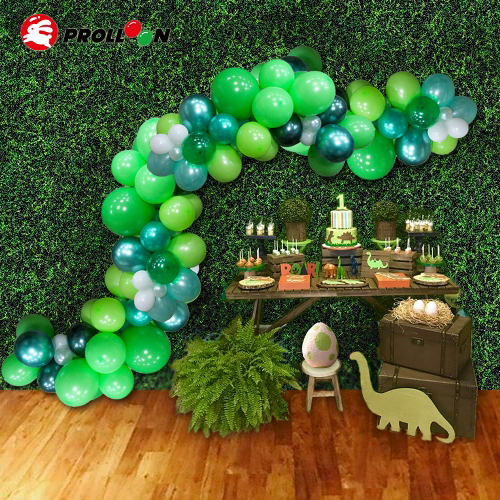
Identify the location of brown chests. This screenshot has width=500, height=500. (401, 356).